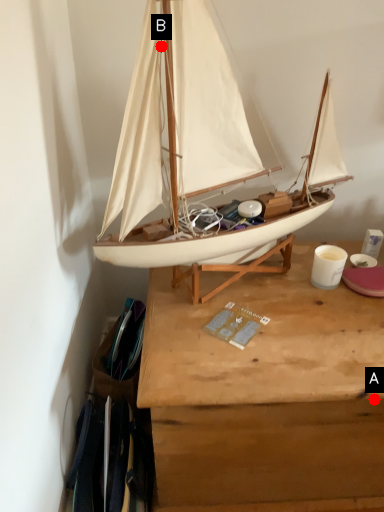
Question: Two points are circled on the image, labeled by A and B beside each circle. Among these points, which one is farthest from the camera?

Choices:
 (A) A is further
 (B) B is further

Answer: (A)